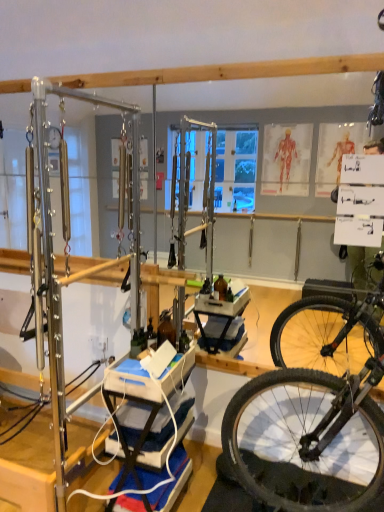
Identify the location of blue fabric yoga mat at lower center. Image resolution: width=384 pixels, height=512 pixels. (172, 482).

Describe the element at coordinates (172, 482) in the screenshot. I see `blue fabric yoga mat at lower center` at that location.

The width and height of the screenshot is (384, 512). What do you see at coordinates (138, 406) in the screenshot?
I see `wooden table at center` at bounding box center [138, 406].

You are a GUI agent. You are given a task and a screenshot of the screen. Output one action in this format:
    pyautogui.click(x=<x>, y=<y>)
    Task: Click on the wooden table at center
    The width and height of the screenshot is (384, 512).
    Given the screenshot: What is the action you would take?
    pyautogui.click(x=138, y=406)

Find the location of a particular element. This screenshot has width=384, height=512. blue fabric yoga mat at lower center is located at coordinates (172, 482).

Considering the positions of objects wooden table at center and blue fabric yoga mat at lower center in the image provided, who is more to the right, wooden table at center or blue fabric yoga mat at lower center?

wooden table at center is more to the right.

Which object is further away from the camera taking this photo, wooden table at center or blue fabric yoga mat at lower center?

blue fabric yoga mat at lower center is further from the camera.

Is point (107, 378) closer to viewer compared to point (177, 460)?

That is True.

From the image's perspective, which is above, wooden table at center or blue fabric yoga mat at lower center?

wooden table at center.

From a real-world perspective, is wooden table at center above or below blue fabric yoga mat at lower center?

In terms of real-world spatial position, wooden table at center is above blue fabric yoga mat at lower center.

Which of these two, wooden table at center or blue fabric yoga mat at lower center, is wider?

wooden table at center.

Does wooden table at center have a lesser height compared to blue fabric yoga mat at lower center?

No, wooden table at center is not shorter than blue fabric yoga mat at lower center.

Can you confirm if wooden table at center is bigger than blue fabric yoga mat at lower center?

Yes.

Is blue fabric yoga mat at lower center completely or partially inside wooden table at center?

Yes, blue fabric yoga mat at lower center is a part of wooden table at center.

Are wooden table at center and blue fabric yoga mat at lower center far apart?

That's not correct — wooden table at center is a little close to blue fabric yoga mat at lower center.

Is blue fabric yoga mat at lower center at the back of wooden table at center?

Yes, wooden table at center is positioned with its back facing blue fabric yoga mat at lower center.

How many degrees apart are the facing directions of wooden table at center and blue fabric yoga mat at lower center?

0.000169 degrees separate the facing orientations of wooden table at center and blue fabric yoga mat at lower center.

From the picture: How distant is wooden table at center from blue fabric yoga mat at lower center?

wooden table at center and blue fabric yoga mat at lower center are 8.77 inches apart from each other.

The image size is (384, 512). What are the coordinates of `workbench in front of the blue fabric yoga mat at lower center` in the screenshot? It's located at (138, 406).

Is blue fabric yoga mat at lower center to the left of wooden table at center from the viewer's perspective?

Yes, blue fabric yoga mat at lower center is to the left of wooden table at center.

Looking at this image, is blue fabric yoga mat at lower center positioned in front of wooden table at center?

No, it is behind wooden table at center.

Which is behind, point (179, 489) or point (128, 457)?

The point (179, 489) is more distant.

From the image's perspective, is blue fabric yoga mat at lower center over wooden table at center?

No, from the image's perspective, blue fabric yoga mat at lower center is not over wooden table at center.

From a real-world perspective, is blue fabric yoga mat at lower center physically above wooden table at center?

No, from a real-world perspective, blue fabric yoga mat at lower center is not over wooden table at center

Does blue fabric yoga mat at lower center have a lesser width compared to wooden table at center?

Correct, the width of blue fabric yoga mat at lower center is less than that of wooden table at center.

Does blue fabric yoga mat at lower center have a greater height compared to wooden table at center?

No.

Can you confirm if blue fabric yoga mat at lower center is bigger than wooden table at center?

No, blue fabric yoga mat at lower center is not bigger than wooden table at center.

Is wooden table at center completely or partially inside blue fabric yoga mat at lower center?

Definitely not — wooden table at center is not inside blue fabric yoga mat at lower center.

Are blue fabric yoga mat at lower center and wooden table at center making contact?

No, blue fabric yoga mat at lower center is not in contact with wooden table at center.

Could you tell me if blue fabric yoga mat at lower center is facing wooden table at center?

Yes, blue fabric yoga mat at lower center is oriented towards wooden table at center.

How different are the orientations of blue fabric yoga mat at lower center and wooden table at center in degrees?

They differ by 0.000169 degrees in their facing directions.

At what (x,y) coordinates should I click in order to perform the action: click on workbench on the right of blue fabric yoga mat at lower center. Please return your answer as a coordinate pair (x, y). Looking at the image, I should click on (138, 406).

Image resolution: width=384 pixels, height=512 pixels. Find the location of `workbench to the right of blue fabric yoga mat at lower center`. workbench to the right of blue fabric yoga mat at lower center is located at coordinates (138, 406).

There is a blue fabric yoga mat at lower center. Where is `workbench above it (from a real-world perspective)`? Image resolution: width=384 pixels, height=512 pixels. workbench above it (from a real-world perspective) is located at coordinates (138, 406).